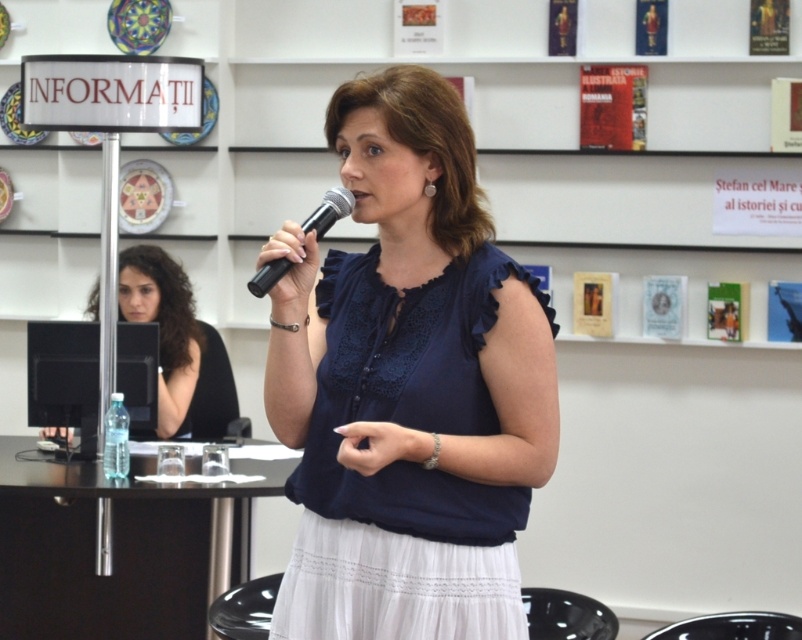
Question: Which is farther from the black fabric shirt at center?

Choices:
 (A) black plastic microphone at center
 (B) matte blue blouse at center

Answer: (A)

Question: Which point is closer to the camera taking this photo?

Choices:
 (A) (161, 250)
 (B) (277, 404)

Answer: (B)

Question: Is black fabric shirt at center positioned in front of black plastic microphone at center?

Choices:
 (A) yes
 (B) no

Answer: (B)

Question: Is black fabric shirt at center below black plastic microphone at center?

Choices:
 (A) yes
 (B) no

Answer: (A)

Question: Is matte blue blouse at center further to camera compared to black fabric shirt at center?

Choices:
 (A) no
 (B) yes

Answer: (A)

Question: Among these objects, which one is farthest from the camera?

Choices:
 (A) black fabric shirt at center
 (B) matte blue blouse at center
 (C) black plastic microphone at center

Answer: (A)